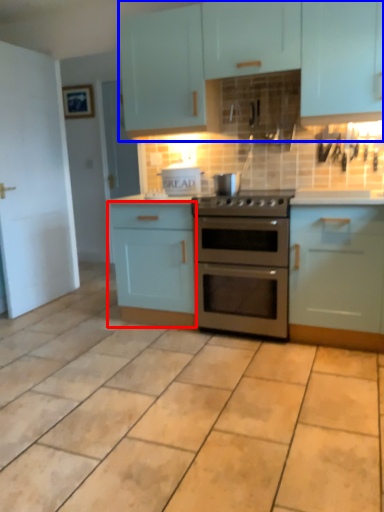
Question: Which point is further to the camera, cabinetry (highlighted by a red box) or cabinetry (highlighted by a blue box)?

Choices:
 (A) cabinetry
 (B) cabinetry

Answer: (A)